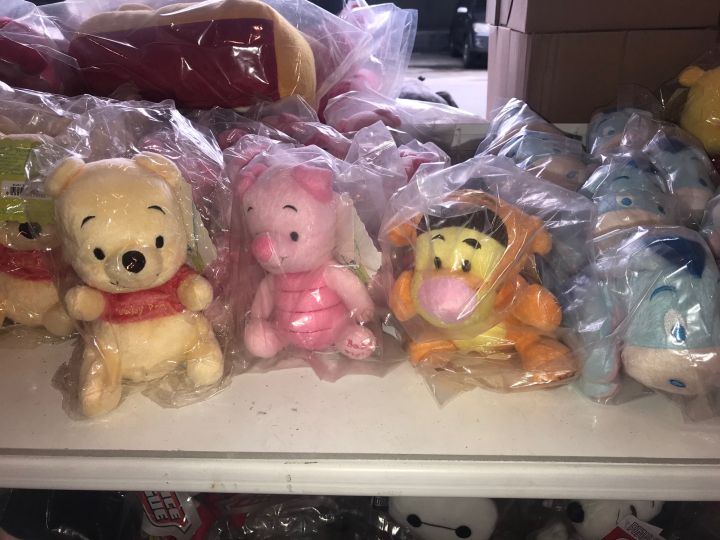
The width and height of the screenshot is (720, 540). I want to click on pooh bear plush toys, so click(x=119, y=205), click(x=14, y=167), click(x=14, y=124), click(x=117, y=131), click(x=78, y=98).